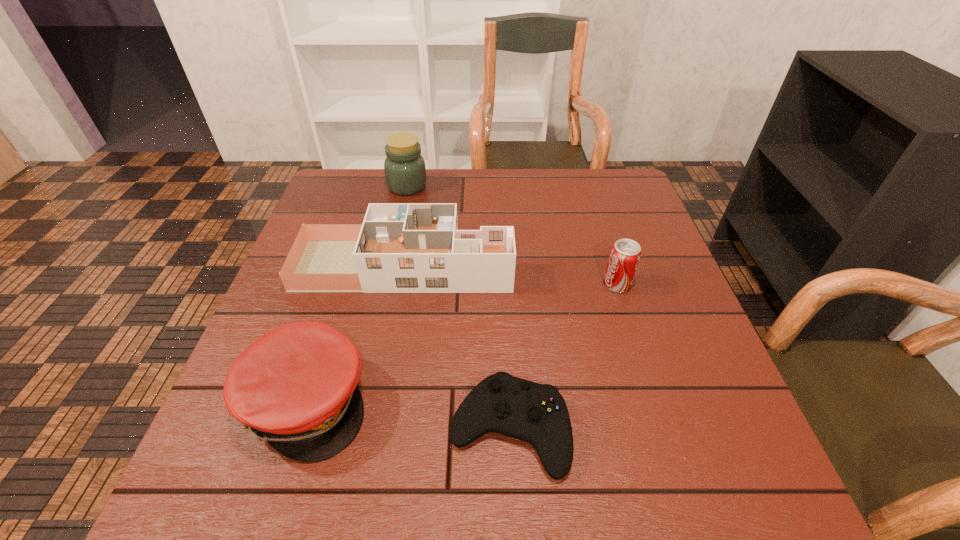
The image size is (960, 540). Identify the location of free point between the farthest object and the shortest object. (458, 307).

The width and height of the screenshot is (960, 540). What are the coordinates of `object that is the second closest to the rightmost object` in the screenshot? It's located at (535, 413).

You are a GUI agent. You are given a task and a screenshot of the screen. Output one action in this format:
    pyautogui.click(x=<x>, y=<y>)
    Task: Click on the fourth closest object relative to the shortest object
    The height and width of the screenshot is (540, 960).
    Given the screenshot: What is the action you would take?
    pyautogui.click(x=405, y=171)

Where is `vacant area that satisfies the following two spatial constraints: 1. on the front side of the control; 2. on the right side of the farthest object`? The height and width of the screenshot is (540, 960). vacant area that satisfies the following two spatial constraints: 1. on the front side of the control; 2. on the right side of the farthest object is located at coordinates (355, 429).

Locate an element on the screen. The image size is (960, 540). vacant region that satisfies the following two spatial constraints: 1. on the front side of the rightmost object; 2. on the right side of the farthest object is located at coordinates (386, 284).

The height and width of the screenshot is (540, 960). I want to click on vacant space that satisfies the following two spatial constraints: 1. at the front of the cap where the visor is located; 2. on the right side of the control, so click(299, 429).

The width and height of the screenshot is (960, 540). I want to click on free location that satisfies the following two spatial constraints: 1. on the front side of the soda can; 2. at the front of the cap where the visor is located, so click(654, 402).